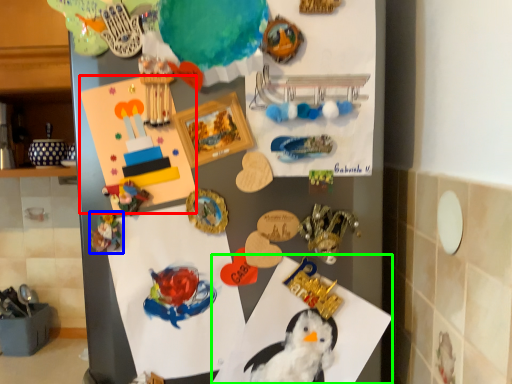
Question: Based on their relative distances, which object is nearer to postcard (highlighted by a red box)? Choose from art (highlighted by a blue box) and paper (highlighted by a green box).

Choices:
 (A) art
 (B) paper

Answer: (A)